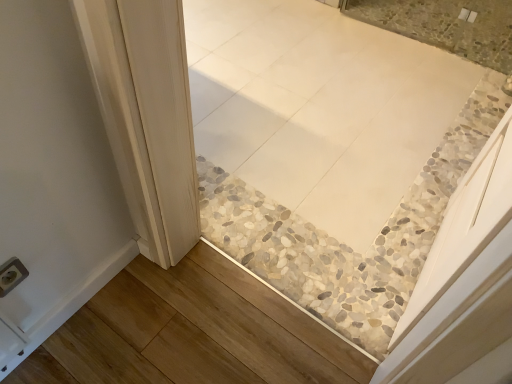
Question: Can you confirm if white plastic electric outlet at lower left is positioned to the right of white glossy tile at upper center?

Choices:
 (A) no
 (B) yes

Answer: (A)

Question: Is white plastic electric outlet at lower left shorter than white glossy tile at upper center?

Choices:
 (A) yes
 (B) no

Answer: (B)

Question: Would you say white plastic electric outlet at lower left is a long distance from white glossy tile at upper center?

Choices:
 (A) yes
 (B) no

Answer: (A)

Question: Does white plastic electric outlet at lower left have a larger size compared to white glossy tile at upper center?

Choices:
 (A) yes
 (B) no

Answer: (B)

Question: Can you confirm if white plastic electric outlet at lower left is positioned to the left of white glossy tile at upper center?

Choices:
 (A) no
 (B) yes

Answer: (B)

Question: Is white plastic electric outlet at lower left in front of white glossy tile at upper center?

Choices:
 (A) no
 (B) yes

Answer: (B)

Question: Does white glossy tile at upper center have a greater height compared to white plastic electric outlet at lower left?

Choices:
 (A) no
 (B) yes

Answer: (A)

Question: Is white glossy tile at upper center looking in the opposite direction of white plastic electric outlet at lower left?

Choices:
 (A) yes
 (B) no

Answer: (B)

Question: From the image's perspective, is white glossy tile at upper center located beneath white plastic electric outlet at lower left?

Choices:
 (A) yes
 (B) no

Answer: (B)

Question: Is white glossy tile at upper center smaller than white plastic electric outlet at lower left?

Choices:
 (A) no
 (B) yes

Answer: (A)

Question: Is white glossy tile at upper center wider than white plastic electric outlet at lower left?

Choices:
 (A) no
 (B) yes

Answer: (B)

Question: Is white glossy tile at upper center far away from white plastic electric outlet at lower left?

Choices:
 (A) no
 (B) yes

Answer: (B)

Question: From the image's perspective, is white glossy tile at upper center located above or below white plastic electric outlet at lower left?

Choices:
 (A) below
 (B) above

Answer: (B)